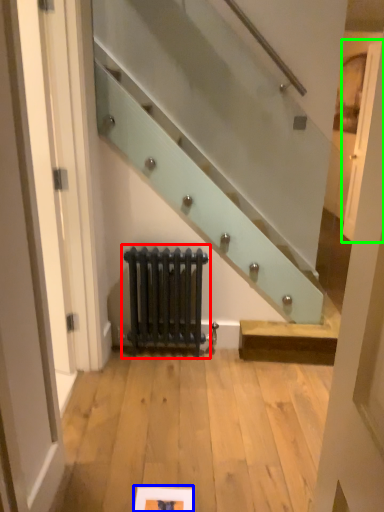
Question: Based on their relative distances, which object is farther from radiator (highlighted by a red box)? Choose from picture frame (highlighted by a blue box) and door (highlighted by a green box).

Choices:
 (A) picture frame
 (B) door

Answer: (B)